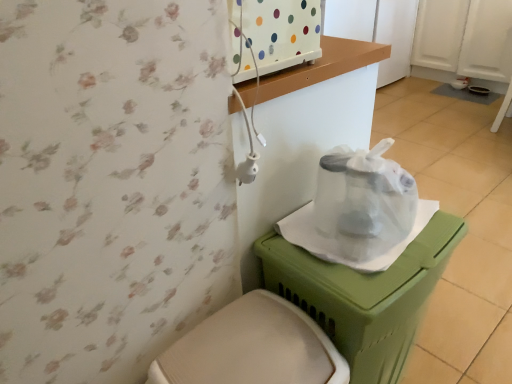
Question: From a real-world perspective, does white plastic toilet at lower center stand above transparent plastic bag at center?

Choices:
 (A) no
 (B) yes

Answer: (A)

Question: Does white plastic toilet at lower center contain transparent plastic bag at center?

Choices:
 (A) yes
 (B) no

Answer: (B)

Question: Does white plastic toilet at lower center appear on the right side of transparent plastic bag at center?

Choices:
 (A) no
 (B) yes

Answer: (A)

Question: From a real-world perspective, is white plastic toilet at lower center located beneath transparent plastic bag at center?

Choices:
 (A) no
 (B) yes

Answer: (B)

Question: From the image's perspective, is white plastic toilet at lower center located beneath transparent plastic bag at center?

Choices:
 (A) yes
 (B) no

Answer: (A)

Question: Is green plastic potty at lower right in front of or behind transparent plastic bag at center in the image?

Choices:
 (A) front
 (B) behind

Answer: (A)

Question: Is point (347, 331) positioned closer to the camera than point (376, 221)?

Choices:
 (A) closer
 (B) farther

Answer: (A)

Question: In terms of size, does green plastic potty at lower right appear bigger or smaller than transparent plastic bag at center?

Choices:
 (A) big
 (B) small

Answer: (A)

Question: Considering the positions of green plastic potty at lower right and transparent plastic bag at center in the image, is green plastic potty at lower right taller or shorter than transparent plastic bag at center?

Choices:
 (A) tall
 (B) short

Answer: (A)

Question: From the image's perspective, is white plastic toilet at lower center above or below green plastic potty at lower right?

Choices:
 (A) below
 (B) above

Answer: (A)

Question: Relative to green plastic potty at lower right, is white plastic toilet at lower center in front or behind?

Choices:
 (A) behind
 (B) front

Answer: (B)

Question: From their relative heights in the image, would you say white plastic toilet at lower center is taller or shorter than green plastic potty at lower right?

Choices:
 (A) short
 (B) tall

Answer: (A)

Question: From a real-world perspective, is white plastic toilet at lower center above or below green plastic potty at lower right?

Choices:
 (A) above
 (B) below

Answer: (B)

Question: Do you think green plastic potty at lower right is within white plastic toilet at lower center, or outside of it?

Choices:
 (A) inside
 (B) outside

Answer: (B)

Question: From the image's perspective, relative to white plastic toilet at lower center, is green plastic potty at lower right above or below?

Choices:
 (A) above
 (B) below

Answer: (A)